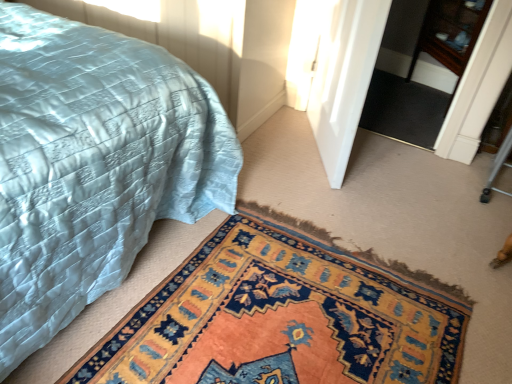
Question: Should I look upward or downward to see matte blue quilt at lower left?

Choices:
 (A) down
 (B) up

Answer: (B)

Question: Is black carpet at center aimed at matte blue quilt at lower left?

Choices:
 (A) no
 (B) yes

Answer: (A)

Question: From a real-world perspective, is black carpet at center physically below matte blue quilt at lower left?

Choices:
 (A) no
 (B) yes

Answer: (B)

Question: Does black carpet at center have a lesser width compared to matte blue quilt at lower left?

Choices:
 (A) no
 (B) yes

Answer: (B)

Question: From the image's perspective, is black carpet at center beneath matte blue quilt at lower left?

Choices:
 (A) no
 (B) yes

Answer: (A)

Question: Can you confirm if black carpet at center is wider than matte blue quilt at lower left?

Choices:
 (A) yes
 (B) no

Answer: (B)

Question: From the image's perspective, is black carpet at center located above matte blue quilt at lower left?

Choices:
 (A) no
 (B) yes

Answer: (B)

Question: Does black carpet at center have a smaller size compared to white glossy door at center?

Choices:
 (A) yes
 (B) no

Answer: (A)

Question: From a real-world perspective, does black carpet at center sit lower than white glossy door at center?

Choices:
 (A) no
 (B) yes

Answer: (B)

Question: Can you confirm if black carpet at center is thinner than white glossy door at center?

Choices:
 (A) yes
 (B) no

Answer: (B)

Question: Are black carpet at center and white glossy door at center making contact?

Choices:
 (A) no
 (B) yes

Answer: (A)

Question: Is black carpet at center surrounding white glossy door at center?

Choices:
 (A) no
 (B) yes

Answer: (A)

Question: Is the position of black carpet at center less distant than that of white glossy door at center?

Choices:
 (A) yes
 (B) no

Answer: (B)

Question: Can you confirm if carpeted mat at lower center is smaller than matte blue quilt at lower left?

Choices:
 (A) yes
 (B) no

Answer: (A)